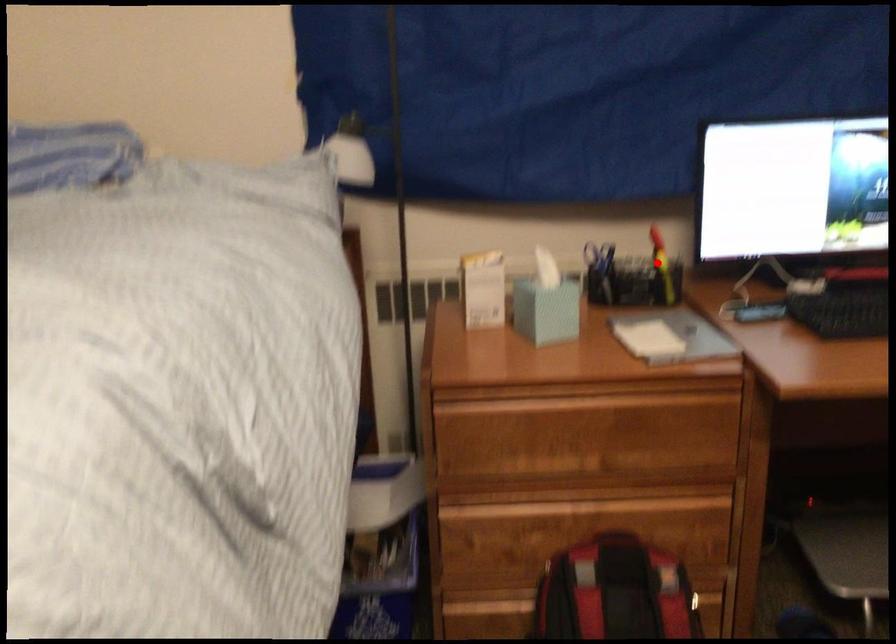
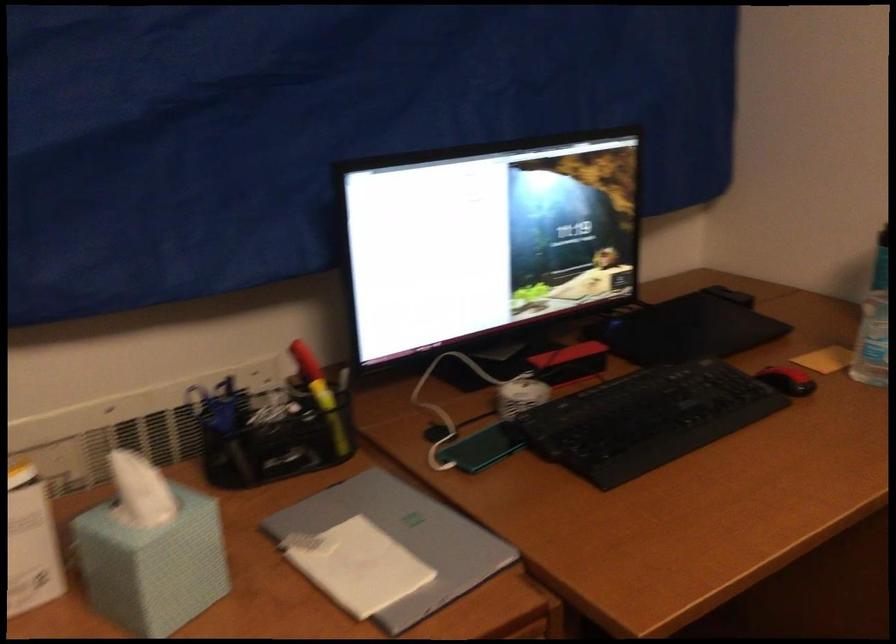
Find the pixel in the second image that matches the highlighted location in the first image.

(321, 395)